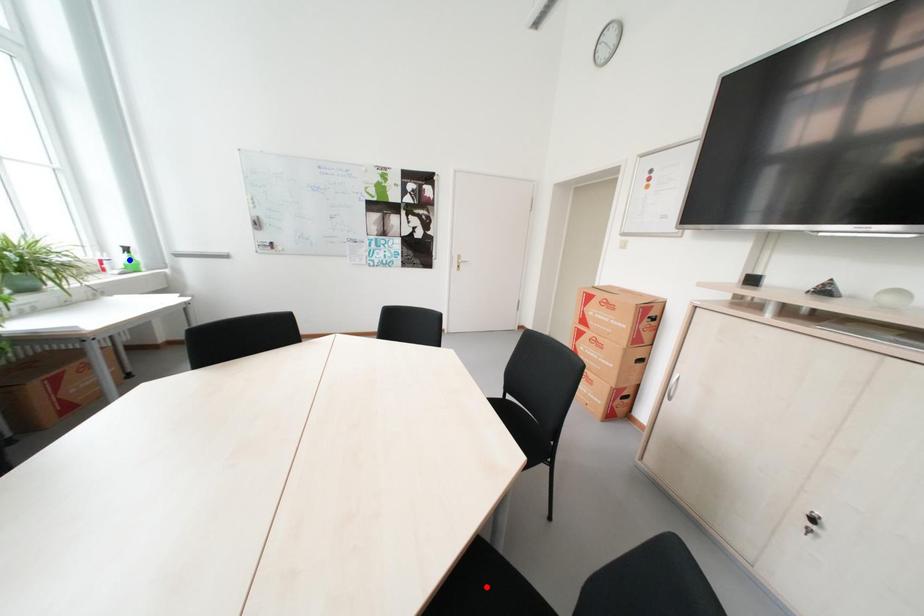
Question: Two points are marked on the image. Which point is closer to the camera?

Choices:
 (A) Blue point is closer.
 (B) Red point is closer.

Answer: (B)